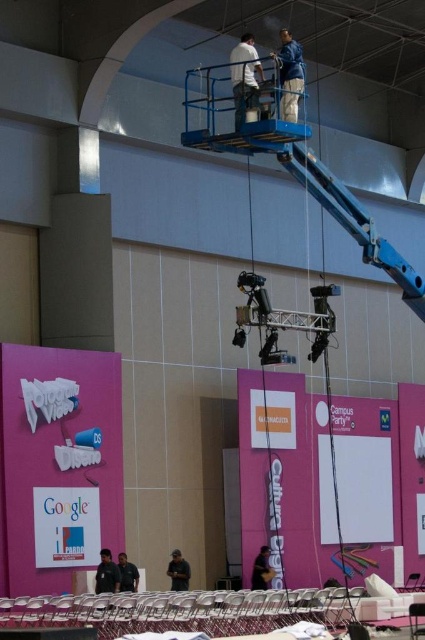
Who is taller, dark gray fabric jacket at lower center or dark gray shirt at lower center?

dark gray fabric jacket at lower center is taller.

Does dark gray fabric jacket at lower center appear over dark gray shirt at lower center?

No.

Between point (189, 573) and point (127, 557), which one is positioned behind?

The point (189, 573) is more distant.

What are the coordinates of `dark gray fabric jacket at lower center` in the screenshot? It's located at (178, 572).

Is black fabric person at lower left wider than dark brown leather jacket at lower center?

Incorrect, black fabric person at lower left's width does not surpass dark brown leather jacket at lower center's.

Which is above, black fabric person at lower left or dark brown leather jacket at lower center?

black fabric person at lower left is above.

At what (x,y) coordinates should I click in order to perform the action: click on black fabric person at lower left. Please return your answer as a coordinate pair (x, y). The height and width of the screenshot is (640, 425). Looking at the image, I should click on (107, 573).

This screenshot has width=425, height=640. Identify the location of black fabric person at lower left. (107, 573).

Who is positioned more to the right, dark gray fabric jacket at lower center or dark brown leather jacket at lower center?

From the viewer's perspective, dark brown leather jacket at lower center appears more on the right side.

Where is `dark gray fabric jacket at lower center`? This screenshot has width=425, height=640. dark gray fabric jacket at lower center is located at coordinates (178, 572).

Is point (180, 580) closer to viewer compared to point (260, 572)?

Yes, point (180, 580) is closer to viewer.

I want to click on dark gray fabric jacket at lower center, so click(178, 572).